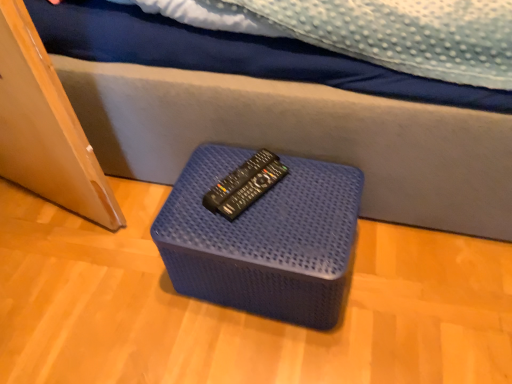
Question: Based on their sizes in the image, would you say black plastic remote at center is bigger or smaller than blue woven ottoman at center?

Choices:
 (A) big
 (B) small

Answer: (B)

Question: Considering the relative positions of black plastic remote at center and blue woven ottoman at center in the image provided, is black plastic remote at center to the left or to the right of blue woven ottoman at center?

Choices:
 (A) left
 (B) right

Answer: (A)

Question: Is point click(x=270, y=153) closer or farther from the camera than point click(x=169, y=200)?

Choices:
 (A) closer
 (B) farther

Answer: (B)

Question: Is point (178, 251) closer or farther from the camera than point (236, 183)?

Choices:
 (A) closer
 (B) farther

Answer: (A)

Question: Based on their positions, is blue woven ottoman at center located to the left or right of black plastic remote at center?

Choices:
 (A) right
 (B) left

Answer: (A)

Question: From the image's perspective, is blue woven ottoman at center located above or below black plastic remote at center?

Choices:
 (A) below
 (B) above

Answer: (A)

Question: From a real-world perspective, is blue woven ottoman at center above or below black plastic remote at center?

Choices:
 (A) below
 (B) above

Answer: (A)